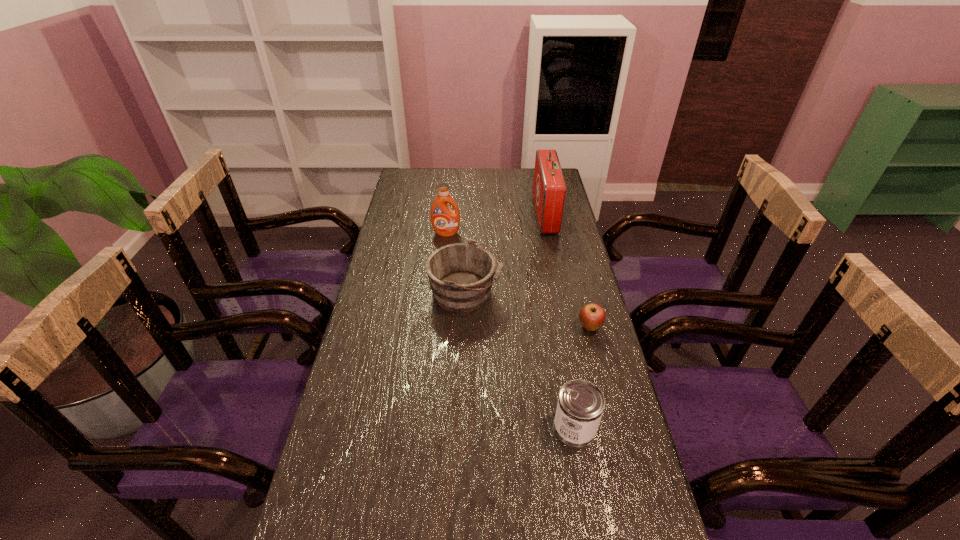
Where is `the first-aid kit`? This screenshot has width=960, height=540. the first-aid kit is located at coordinates (549, 187).

This screenshot has height=540, width=960. I want to click on detergent, so click(x=445, y=222).

You are a GUI agent. You are given a task and a screenshot of the screen. Output one action in this format:
    pyautogui.click(x=<x>, y=<y>)
    Task: Click on the wine bucket
    The width and height of the screenshot is (960, 540).
    Given the screenshot: What is the action you would take?
    pyautogui.click(x=461, y=275)

This screenshot has height=540, width=960. Find the location of `the nearest object`. the nearest object is located at coordinates (580, 406).

You are a GUI agent. You are given a task and a screenshot of the screen. Output one action in this format:
    pyautogui.click(x=<x>, y=<y>)
    Task: Click on the apple
    This screenshot has height=540, width=960.
    Given the screenshot: What is the action you would take?
    pyautogui.click(x=592, y=316)

Where is `free region located 0.170m on the side of the first-aid kit with the first aid cross symbol`? free region located 0.170m on the side of the first-aid kit with the first aid cross symbol is located at coordinates (493, 215).

This screenshot has width=960, height=540. Find the location of `free location located 0.060m on the side of the first-aid kit with the first aid cross symbol`. free location located 0.060m on the side of the first-aid kit with the first aid cross symbol is located at coordinates (521, 215).

This screenshot has width=960, height=540. I want to click on free space located 0.100m on the side of the first-aid kit with the first aid cross symbol, so click(x=511, y=215).

You are a GUI agent. You are given a task and a screenshot of the screen. Output one action in this format:
    pyautogui.click(x=<x>, y=<y>)
    Task: Click on the free space located 0.400m on the front-facing side of the detergent
    
    Given the screenshot: What is the action you would take?
    pyautogui.click(x=439, y=311)

I want to click on vacant space located on the back of the wine bucket, so click(468, 208).